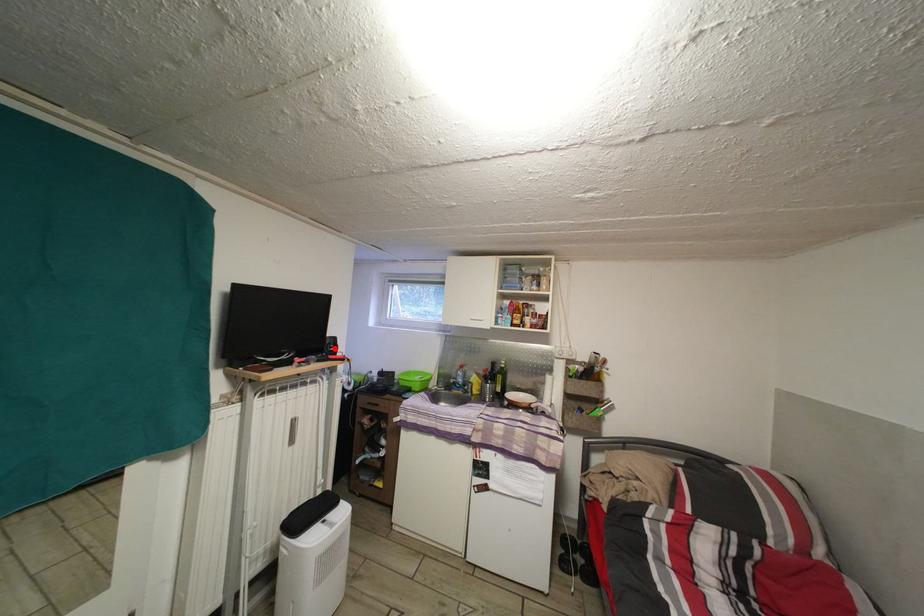
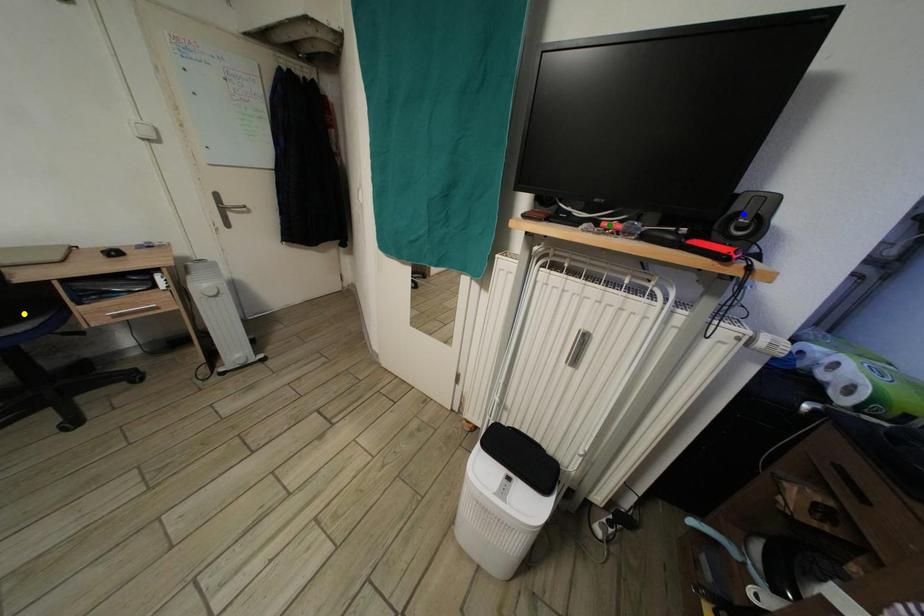
Question: I am providing you with two images of the same scene from different viewpoints. A red point is marked on the first image. You are given multiple points on the second image. Can you choose the point in image 2 that corresponds to the point in image 1?

Choices:
 (A) yellow point
 (B) green point
 (C) blue point

Answer: (C)